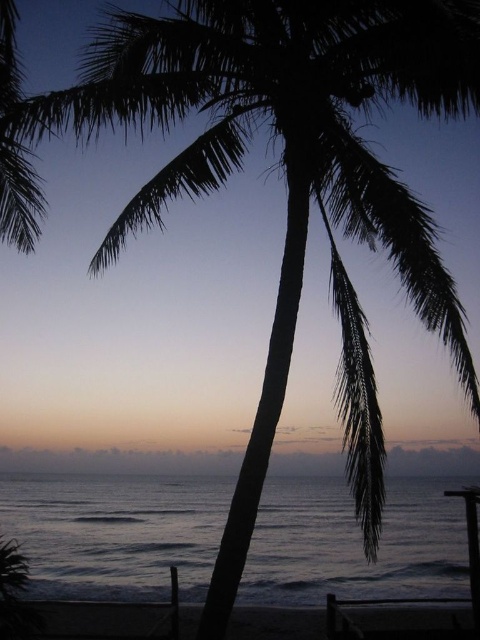
Question: Is dark blue water at lower left wider than dark sand at lower center?

Choices:
 (A) no
 (B) yes

Answer: (B)

Question: Which of the following is the closest to the observer?

Choices:
 (A) (277, 608)
 (B) (70, 531)

Answer: (A)

Question: From the image, what is the correct spatial relationship of dark blue water at lower left in relation to dark sand at lower center?

Choices:
 (A) below
 (B) above

Answer: (A)

Question: Which point appears farthest from the camera in this image?

Choices:
 (A) (468, 480)
 (B) (299, 621)

Answer: (A)

Question: Can you confirm if dark blue water at lower left is positioned above dark sand at lower center?

Choices:
 (A) no
 (B) yes

Answer: (A)